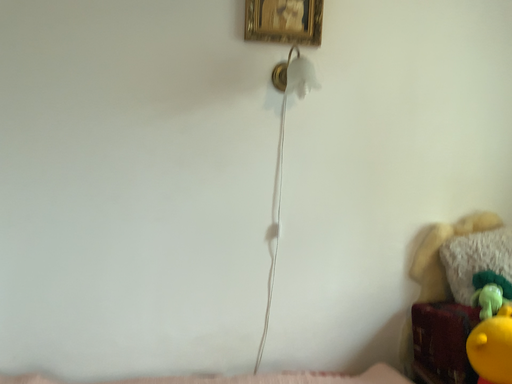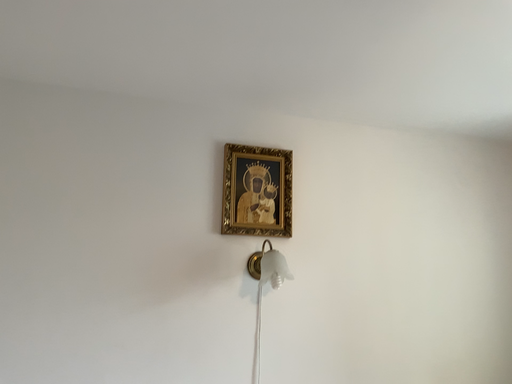
Question: How did the camera likely rotate when shooting the video?

Choices:
 (A) rotated downward
 (B) rotated upward

Answer: (B)